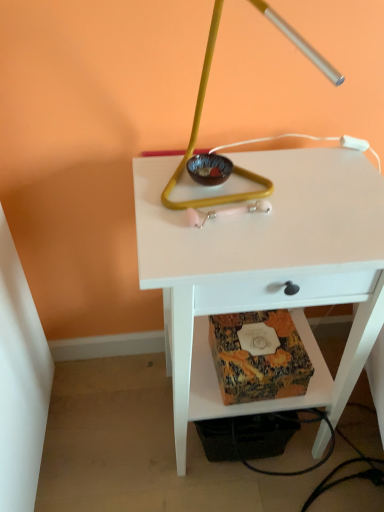
Locate an element on the screen. matte brown glass bowl at center is located at coordinates (209, 169).

Does point (227, 292) come farther from viewer compared to point (306, 372)?

No.

You are a GUI agent. You are given a task and a screenshot of the screen. Output one action in this format:
    pyautogui.click(x=<x>, y=<y>)
    Task: Click on the paperback book that appears below the white matte table at center (from the image's perspective)
    The height and width of the screenshot is (512, 384).
    Given the screenshot: What is the action you would take?
    (258, 357)

In the scene shown: Which of these two, white matte table at center or patterned paper at lower center, is bigger?

white matte table at center.

Would you say patterned paper at lower center is part of white matte table at center's contents?

Yes.

Which object is further away from the camera taking this photo, matte brown glass bowl at center or patterned paper at lower center?

patterned paper at lower center is further from the camera.

Can you confirm if matte brown glass bowl at center is thinner than patterned paper at lower center?

Yes.

Is matte brown glass bowl at center bigger than patterned paper at lower center?

No.

Is point (177, 323) farther from camera compared to point (261, 3)?

Yes, it is.

In the scene shown: Which of these two, white matte table at center or metallic gold lamp at center, stands taller?

white matte table at center.

Is white matte table at center positioned with its back to metallic gold lamp at center?

No, white matte table at center's orientation is not away from metallic gold lamp at center.

Are white matte table at center and metallic gold lamp at center beside each other?

No, white matte table at center is not in contact with metallic gold lamp at center.

Locate an element on the screen. This screenshot has width=384, height=512. lamp in front of the matte brown glass bowl at center is located at coordinates (196, 139).

From the image's perspective, which one is positioned lower, matte brown glass bowl at center or metallic gold lamp at center?

matte brown glass bowl at center, from the image's perspective.

Is matte brown glass bowl at center positioned beyond the bounds of metallic gold lamp at center?

No.

Considering the relative sizes of matte brown glass bowl at center and metallic gold lamp at center in the image provided, is matte brown glass bowl at center thinner than metallic gold lamp at center?

Correct, the width of matte brown glass bowl at center is less than that of metallic gold lamp at center.

Considering the sizes of objects white matte table at center and matte brown glass bowl at center in the image provided, who is thinner, white matte table at center or matte brown glass bowl at center?

With smaller width is matte brown glass bowl at center.

Is point (204, 302) behind point (188, 161)?

No, (204, 302) is in front of (188, 161).

Considering the sizes of white matte table at center and matte brown glass bowl at center in the image, is white matte table at center bigger or smaller than matte brown glass bowl at center?

white matte table at center is bigger than matte brown glass bowl at center.

Identify the location of lamp that appears in front of the patterned paper at lower center. 196,139.

Is patterned paper at lower center closer to the viewer compared to metallic gold lamp at center?

No, it is not.

Between patterned paper at lower center and metallic gold lamp at center, which one has less height?

patterned paper at lower center.

Is point (225, 384) positioned after point (214, 34)?

Yes.

The image size is (384, 512). Find the location of `glass bowl that appears above the patterned paper at lower center (from a real-world perspective)`. glass bowl that appears above the patterned paper at lower center (from a real-world perspective) is located at coordinates (209, 169).

Does patterned paper at lower center have a larger size compared to matte brown glass bowl at center?

Indeed, patterned paper at lower center has a larger size compared to matte brown glass bowl at center.

Is patterned paper at lower center oriented towards matte brown glass bowl at center?

No, patterned paper at lower center does not turn towards matte brown glass bowl at center.

Is the position of patterned paper at lower center more distant than that of matte brown glass bowl at center?

Yes, patterned paper at lower center is behind matte brown glass bowl at center.

At what (x,y) coordinates should I click in order to perform the action: click on table above the patterned paper at lower center (from the image's perspective). Please return your answer as a coordinate pair (x, y). The image size is (384, 512). Looking at the image, I should click on (265, 270).

I want to click on paperback book below the matte brown glass bowl at center (from the image's perspective), so 258,357.

Based on their spatial positions, is metallic gold lamp at center or patterned paper at lower center closer to matte brown glass bowl at center?

metallic gold lamp at center lies closer to matte brown glass bowl at center than the other object.

Looking at the image, which one is located closer to metallic gold lamp at center, white matte table at center or matte brown glass bowl at center?

The object closer to metallic gold lamp at center is matte brown glass bowl at center.

Which object lies nearer to the anchor point metallic gold lamp at center, patterned paper at lower center or matte brown glass bowl at center?

Based on the image, matte brown glass bowl at center appears to be nearer to metallic gold lamp at center.

Looking at the image, which one is located closer to white matte table at center, metallic gold lamp at center or matte brown glass bowl at center?

metallic gold lamp at center lies closer to white matte table at center than the other object.

Considering their positions, is white matte table at center positioned further to metallic gold lamp at center than patterned paper at lower center?

patterned paper at lower center is further to metallic gold lamp at center.

Consider the image. When comparing their distances from patterned paper at lower center, does white matte table at center or matte brown glass bowl at center seem further?

Among the two, matte brown glass bowl at center is located further to patterned paper at lower center.

Consider the image. From the image, which object appears to be farther from white matte table at center, patterned paper at lower center or metallic gold lamp at center?

Among the two, metallic gold lamp at center is located further to white matte table at center.

Based on their spatial positions, is patterned paper at lower center or white matte table at center further from matte brown glass bowl at center?

The object further to matte brown glass bowl at center is patterned paper at lower center.

You are a GUI agent. You are given a task and a screenshot of the screen. Output one action in this format:
    pyautogui.click(x=<x>, y=<y>)
    Task: Click on the glass bowl between metallic gold lamp at center and white matte table at center vertically
    The image size is (384, 512).
    Given the screenshot: What is the action you would take?
    click(209, 169)

Find the location of a particular element. The image size is (384, 512). table between matte brown glass bowl at center and patterned paper at lower center in the vertical direction is located at coordinates (265, 270).

The image size is (384, 512). Identify the location of glass bowl between metallic gold lamp at center and patterned paper at lower center along the z-axis. click(209, 169).

Identify the location of table between metallic gold lamp at center and patterned paper at lower center in the vertical direction. (265, 270).